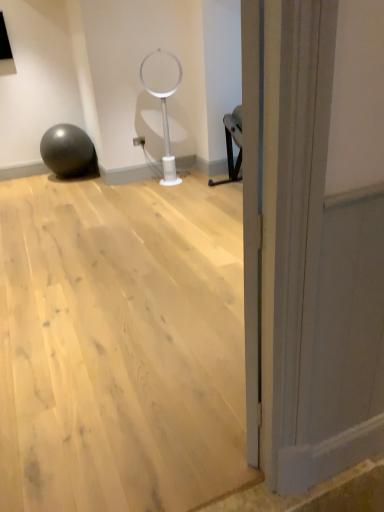
Question: Should I look upward or downward to see matte black ball at left?

Choices:
 (A) up
 (B) down

Answer: (A)